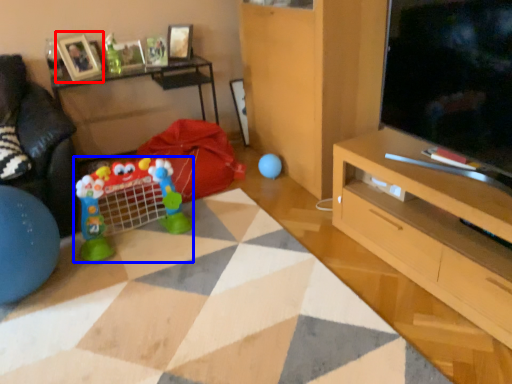
Question: Which object appears closest to the camera in this image, picture frame (highlighted by a red box) or toy (highlighted by a blue box)?

Choices:
 (A) picture frame
 (B) toy

Answer: (B)